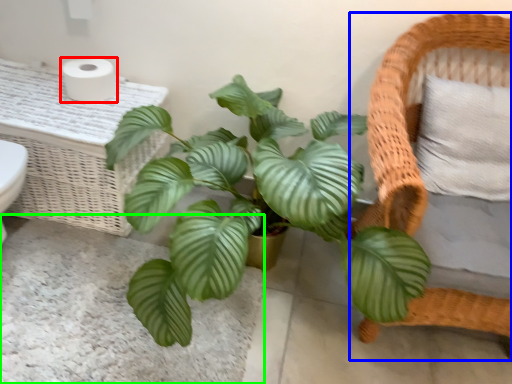
Question: Which object is the closest to the toilet paper (highlighted by a red box)? Choose among these: furniture (highlighted by a blue box) or plain (highlighted by a green box).

Choices:
 (A) furniture
 (B) plain

Answer: (B)